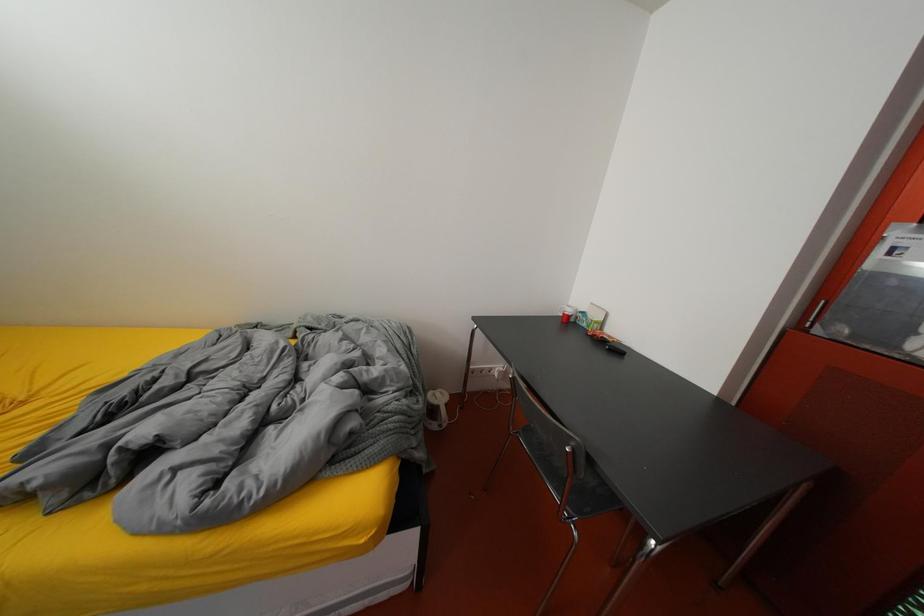
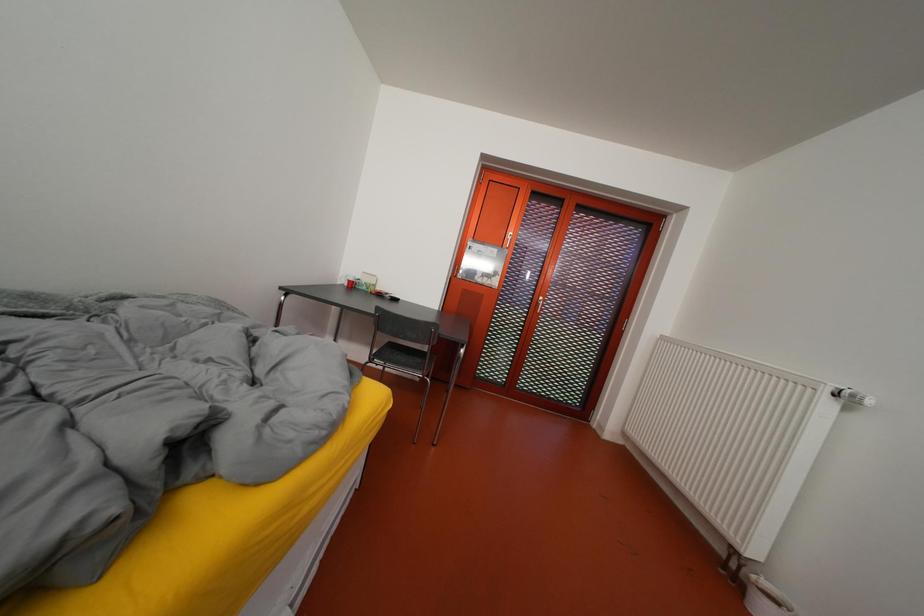
Question: The images are taken continuously from a first-person perspective. In which direction is your viewpoint rotating?

Choices:
 (A) Left
 (B) Right
 (C) Up
 (D) Down

Answer: (B)